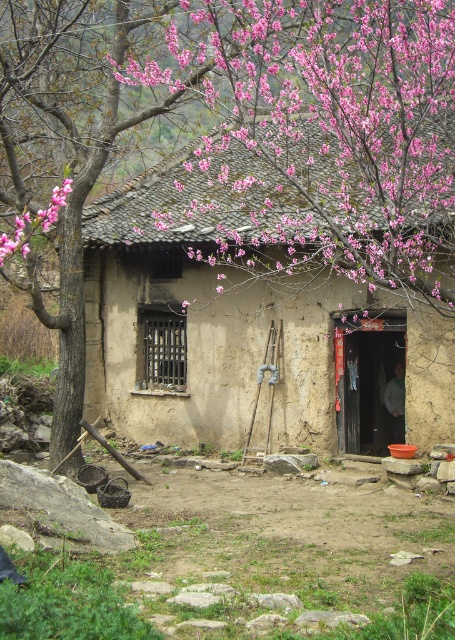
Question: Is brown mud hut at center above pink bloom at upper center?

Choices:
 (A) no
 (B) yes

Answer: (A)

Question: Does brown mud hut at center have a larger size compared to pink bloom at upper center?

Choices:
 (A) yes
 (B) no

Answer: (B)

Question: Is brown mud hut at center bigger than pink bloom at upper center?

Choices:
 (A) no
 (B) yes

Answer: (A)

Question: Which point is closer to the camera taking this photo?

Choices:
 (A) (151, 365)
 (B) (409, 42)

Answer: (B)

Question: Which point is closer to the camera?

Choices:
 (A) (148, 189)
 (B) (284, 220)

Answer: (B)